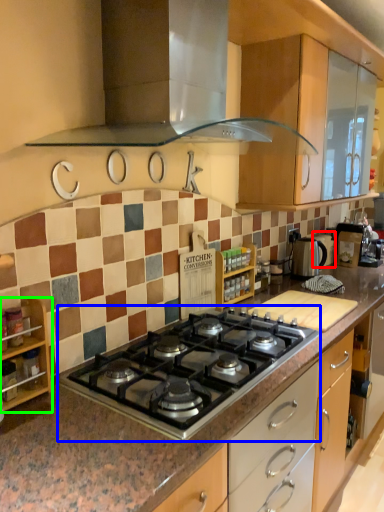
Question: Considering the real-world distances, which object is closest to appliance (highlighted by a red box)? gas stove (highlighted by a blue box) or shelf (highlighted by a green box).

Choices:
 (A) gas stove
 (B) shelf

Answer: (A)